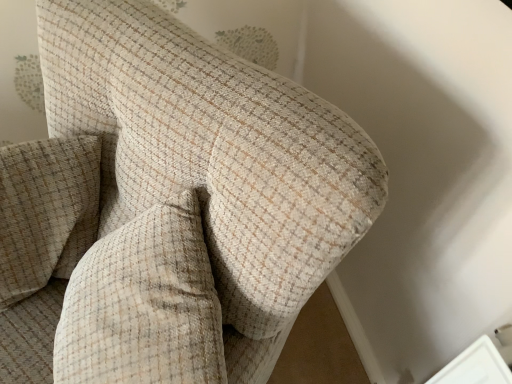
This screenshot has width=512, height=384. In order to click on beige textured pillow at center in this screenshot , I will do coord(144,305).

Describe the element at coordinates (144, 305) in the screenshot. I see `beige textured pillow at center` at that location.

The height and width of the screenshot is (384, 512). I want to click on beige textured pillow at center, so click(144, 305).